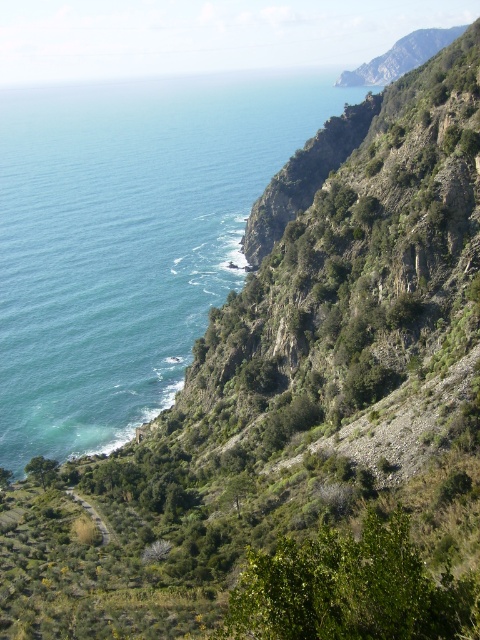
Question: Is blue water at upper left to the right of green grassy path at lower left from the viewer's perspective?

Choices:
 (A) no
 (B) yes

Answer: (A)

Question: Which point is farther from the camera taking this photo?

Choices:
 (A) (57, 122)
 (B) (82, 500)

Answer: (A)

Question: Considering the relative positions of blue water at upper left and green grassy path at lower left in the image provided, where is blue water at upper left located with respect to green grassy path at lower left?

Choices:
 (A) left
 (B) right

Answer: (A)

Question: From the image, what is the correct spatial relationship of blue water at upper left in relation to green grassy path at lower left?

Choices:
 (A) above
 (B) below

Answer: (A)